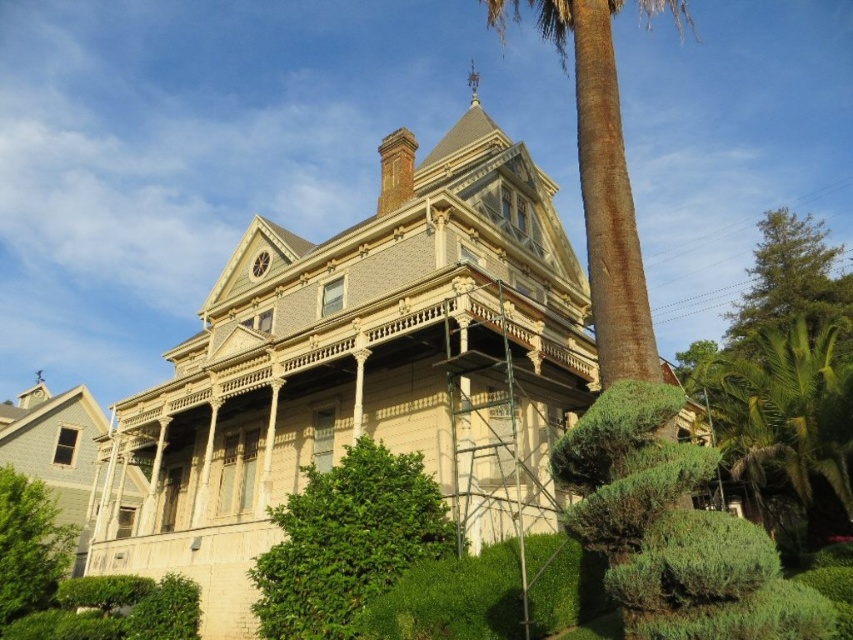
Which is in front, point (381, 588) or point (619, 273)?

Point (381, 588) is more forward.

Is point (329, 506) farther from viewer compared to point (614, 164)?

No, it is in front of (614, 164).

Locate an element on the screen. The image size is (853, 640). green leafy bush at lower center is located at coordinates (347, 541).